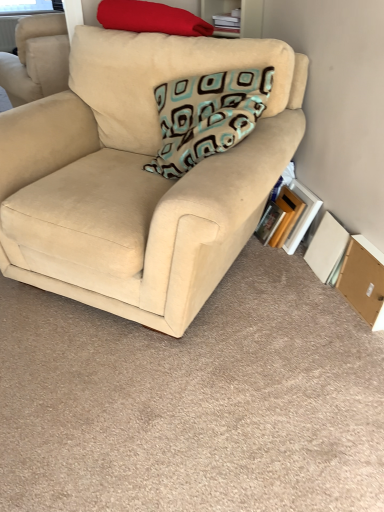
Question: Is hardcover book at lower right, which is the second paperback book from left to right, in front of beige fabric couch at center?

Choices:
 (A) yes
 (B) no

Answer: (B)

Question: Does hardcover book at lower right, the 2th paperback book positioned from the right, appear on the right side of beige fabric couch at center?

Choices:
 (A) no
 (B) yes

Answer: (B)

Question: Is hardcover book at lower right, which is the second paperback book from left to right, positioned far away from beige fabric couch at center?

Choices:
 (A) no
 (B) yes

Answer: (A)

Question: Does hardcover book at lower right, the 2th paperback book positioned from the right, have a larger size compared to beige fabric couch at center?

Choices:
 (A) no
 (B) yes

Answer: (A)

Question: From the image's perspective, is hardcover book at lower right, which is the second paperback book from left to right, below beige fabric couch at center?

Choices:
 (A) yes
 (B) no

Answer: (A)

Question: Does hardcover book at lower right, the 2th paperback book positioned from the right, lie behind beige fabric couch at center?

Choices:
 (A) no
 (B) yes

Answer: (B)

Question: Is brown cardboard box at lower right aimed at matte red pillow at upper left, the 2th pillow when ordered from bottom to top?

Choices:
 (A) yes
 (B) no

Answer: (B)

Question: Is brown cardboard box at lower right behind matte red pillow at upper left, the 2th pillow when ordered from bottom to top?

Choices:
 (A) yes
 (B) no

Answer: (B)

Question: From the image's perspective, is brown cardboard box at lower right beneath matte red pillow at upper left, the 2th pillow when ordered from bottom to top?

Choices:
 (A) no
 (B) yes

Answer: (B)

Question: Is brown cardboard box at lower right directly adjacent to matte red pillow at upper left, the 2th pillow when ordered from bottom to top?

Choices:
 (A) no
 (B) yes

Answer: (A)

Question: Is brown cardboard box at lower right at the left side of matte red pillow at upper left, the 2th pillow when ordered from bottom to top?

Choices:
 (A) no
 (B) yes

Answer: (A)

Question: From the image's perspective, is brown cardboard box at lower right on top of matte red pillow at upper left, the 2th pillow when ordered from bottom to top?

Choices:
 (A) yes
 (B) no

Answer: (B)

Question: Is stacked books at upper center positioned with its back to white cardboard book at lower right, the first paperback book in the right-to-left sequence?

Choices:
 (A) yes
 (B) no

Answer: (B)